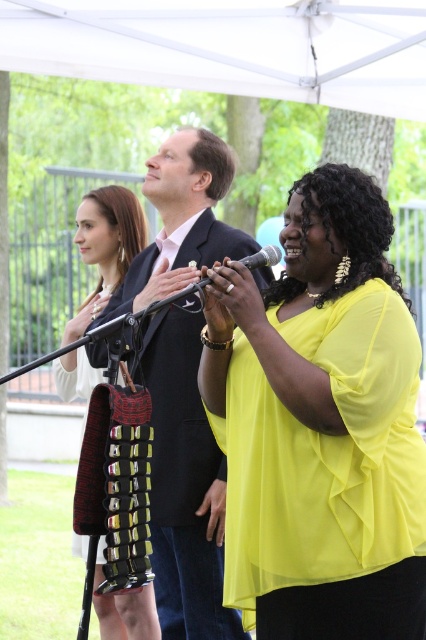
You are planning to set up a small table under the white fabric canopy at upper center. Considering the position of the black textured dress at left, will the table fit underneath the canopy without being obstructed by the dress?

The white fabric canopy at upper center is positioned over the black textured dress at left, so the table can be placed underneath the canopy without obstruction from the dress as the canopy covers the area above the dress.

You are a photographer positioned in front of the white fabric canopy at upper center and the black textured dress at left. Which object is closer to you?

The white fabric canopy at upper center is closer to you because it is further to the viewer than the black textured dress at left.

You are standing at point (x=124, y=204) and want to walk to point (x=244, y=248). Is the destination point in front of or behind you?

The destination point (x=244, y=248) is in front of you because it is located in front of your current position at point (x=124, y=204).